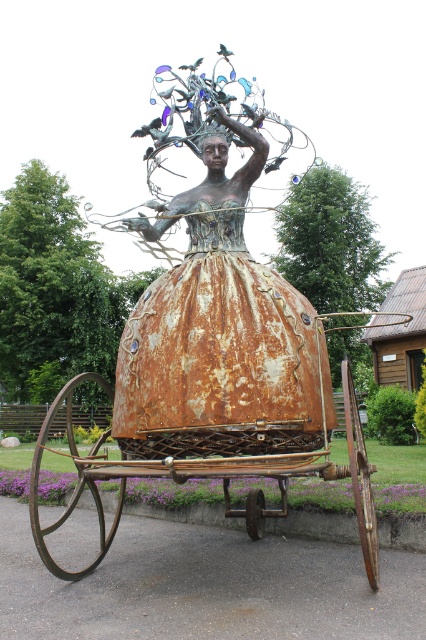
Which of these two, rusty metal sculpture at center or rusty metal wagon at center, stands taller?

With more height is rusty metal wagon at center.

Is point (301, 360) behind point (348, 397)?

Yes, point (301, 360) is farther from viewer.

Between point (210, 413) and point (365, 460), which one is positioned behind?

Positioned behind is point (365, 460).

Locate an element on the screen. Image resolution: width=426 pixels, height=640 pixels. rusty metal sculpture at center is located at coordinates (216, 310).